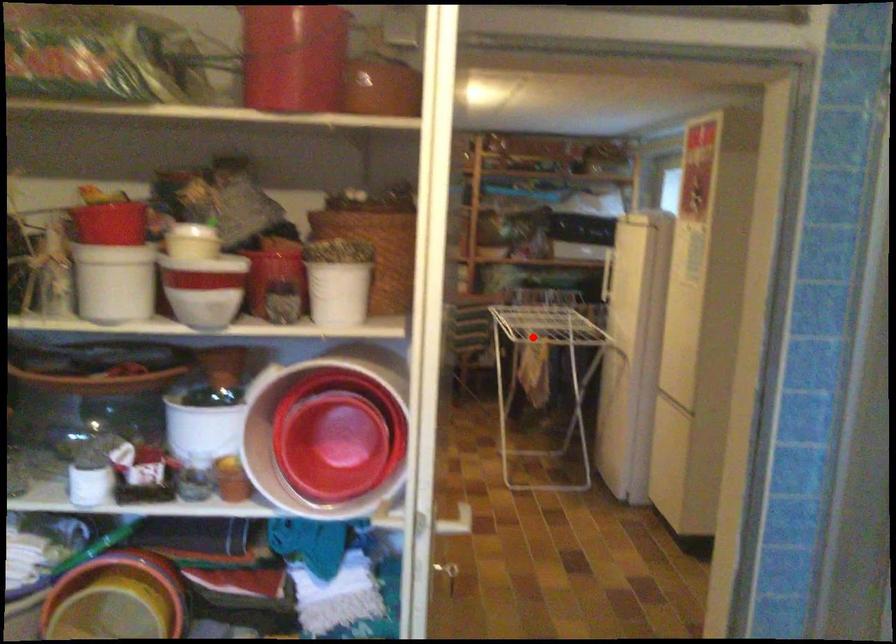
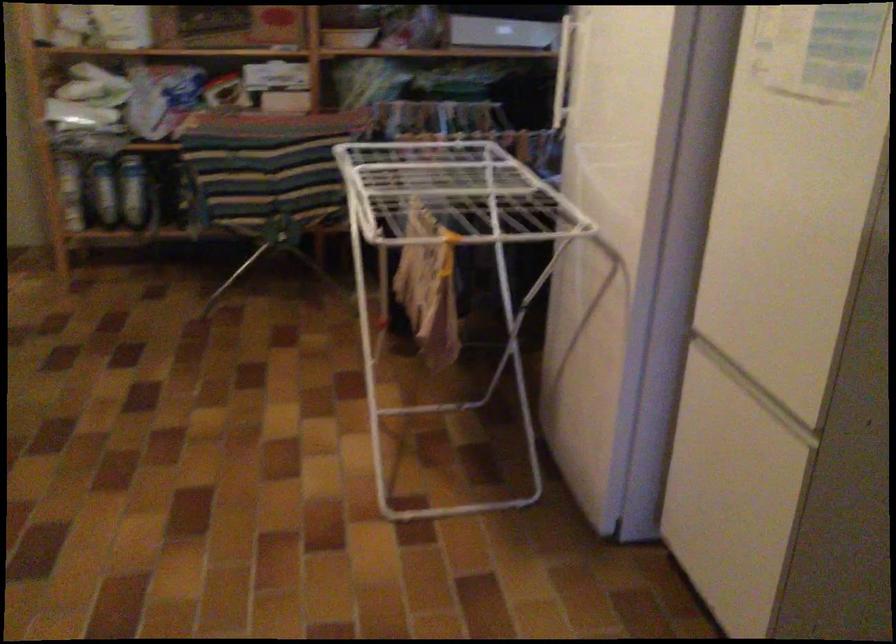
Where in the second image is the point corresponding to the highlighted location from the first image?

(450, 258)